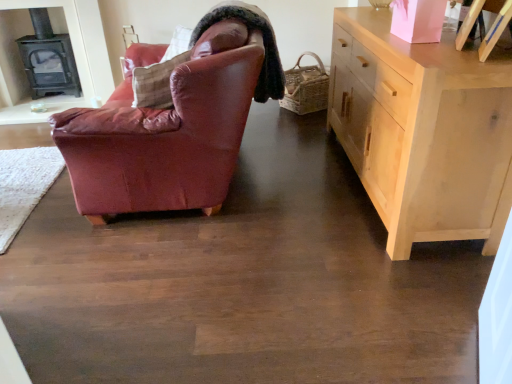
Image resolution: width=512 pixels, height=384 pixels. I want to click on vacant region in front of light wood cabinet at right, so click(x=342, y=294).